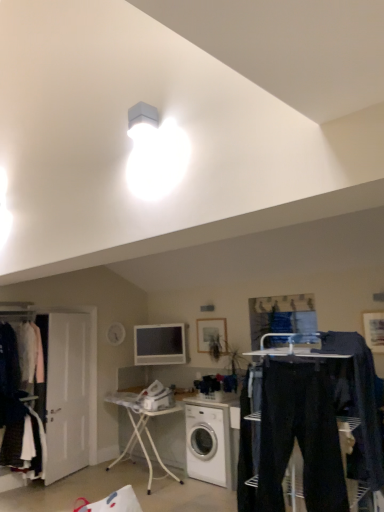
Locate an element on the screen. Image resolution: width=384 pixels, height=512 pixels. free point above white glossy television at center (from a real-world perspective) is located at coordinates (163, 320).